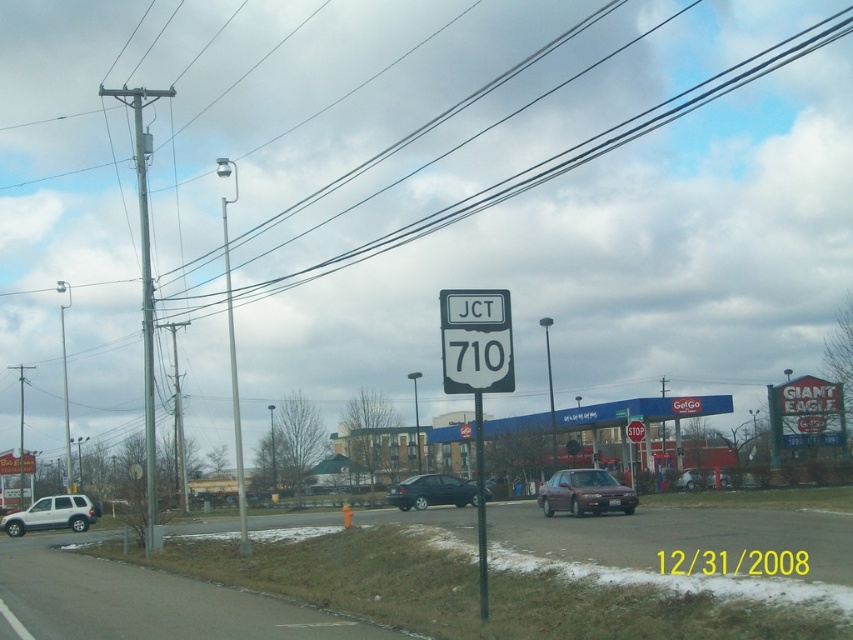
Question: Does white matte suv at lower left appear under matte silver sedan at center?

Choices:
 (A) yes
 (B) no

Answer: (A)

Question: Which object is closer to the camera taking this photo?

Choices:
 (A) satin silver sedan at center
 (B) shiny black sedan at center

Answer: (B)

Question: Which point is closer to the camera?

Choices:
 (A) (585, 493)
 (B) (677, 476)
 (C) (502, 371)

Answer: (C)

Question: Can you confirm if white matte suv at lower left is positioned below shiny black sedan at center?

Choices:
 (A) no
 (B) yes

Answer: (B)

Question: Which of the following is the farthest from the observer?

Choices:
 (A) (422, 490)
 (B) (709, 480)
 (C) (44, 520)
 (D) (612, 138)

Answer: (D)

Question: Is white plastic road sign at center below white matte suv at lower left?

Choices:
 (A) no
 (B) yes

Answer: (A)